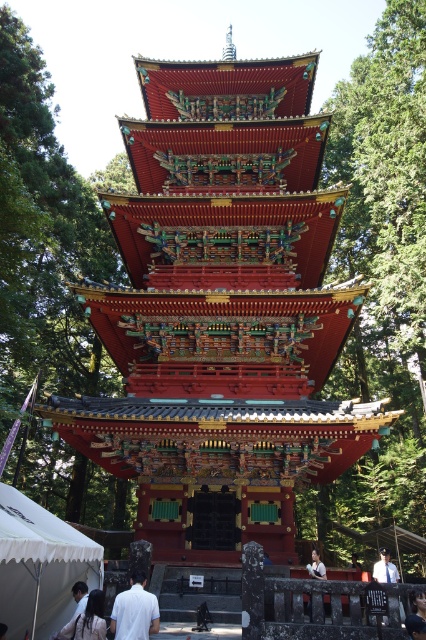
Question: Which point appears farthest from the camera in this image?

Choices:
 (A) (22, 112)
 (B) (98, 628)
 (C) (417, 634)
 (D) (22, 580)

Answer: (A)

Question: Which point is farther from the camera taking this photo?

Choices:
 (A) (115, 602)
 (B) (409, 624)

Answer: (B)

Question: Estimate the real-world distances between objects in this image. Which object is closer to the green textured pagoda at center?

Choices:
 (A) dark hair at lower left
 (B) white fabric tent at lower left

Answer: (A)

Question: Does white fabric tent at lower left have a lesser width compared to white cotton shirt at lower left?

Choices:
 (A) no
 (B) yes

Answer: (B)

Question: Does green textured pagoda at center have a greater width compared to light brown wooden chair at lower center?

Choices:
 (A) no
 (B) yes

Answer: (B)

Question: Is white cotton shirt at lower left to the right of dark blue fabric cap at lower right from the viewer's perspective?

Choices:
 (A) no
 (B) yes

Answer: (A)